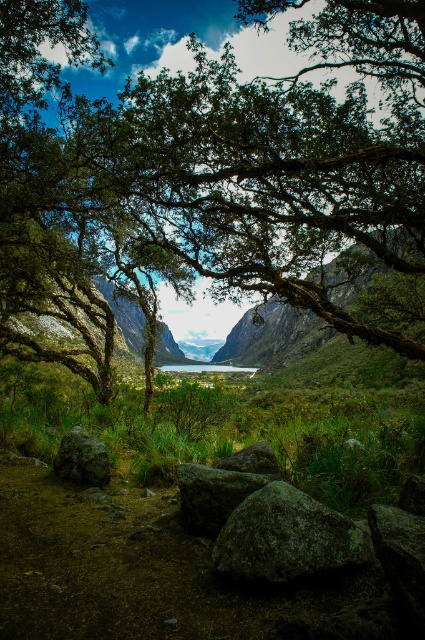
Question: Does rocky cliff at center appear on the right side of rough textured rock at lower left?

Choices:
 (A) no
 (B) yes

Answer: (A)

Question: Which point is closer to the camera?

Choices:
 (A) (249, 467)
 (B) (141, 323)
 (C) (195, 364)

Answer: (A)

Question: Which point is farther from the camera taking this photo?

Choices:
 (A) (105, 448)
 (B) (125, 339)
 (C) (214, 492)

Answer: (B)

Question: Which of these objects is positioned farthest from the gray rough rock at center?

Choices:
 (A) green mossy rock at center
 (B) rocky cliff at center

Answer: (B)

Question: Can you confirm if green leafy tree at center is wider than rocky cliff at center?

Choices:
 (A) no
 (B) yes

Answer: (B)

Question: Is green leafy tree at center to the right of gray rough rock at center from the viewer's perspective?

Choices:
 (A) no
 (B) yes

Answer: (A)